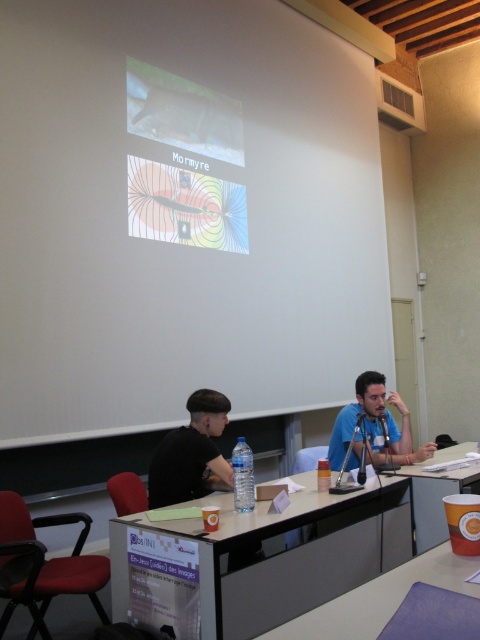
Is the position of black glossy table at center less distant than that of blue matte shirt at center?

Yes, it is in front of blue matte shirt at center.

You are a GUI agent. You are given a task and a screenshot of the screen. Output one action in this format:
    pyautogui.click(x=<x>, y=<y>)
    Task: Click on the black glossy table at center
    
    Given the screenshot: What is the action you would take?
    pyautogui.click(x=279, y=556)

Find the location of a particular element. This screenshot has height=640, width=480. black glossy table at center is located at coordinates (279, 556).

Is black matte shirt at lower left to the right of orange paper cup at lower right from the viewer's perspective?

Incorrect, black matte shirt at lower left is not on the right side of orange paper cup at lower right.

Measure the distance between black matte shirt at lower left and orange paper cup at lower right.

black matte shirt at lower left is 1.03 meters away from orange paper cup at lower right.

Who is more distant from viewer, [173,468] or [474,445]?

Point [474,445]

At what (x,y) coordinates should I click in order to perform the action: click on black matte shirt at lower left. Please return your answer as a coordinate pair (x, y). This screenshot has height=640, width=480. Looking at the image, I should click on (191, 452).

Does purple matte table at center have a larger size compared to orange paper cup at lower right?

Actually, purple matte table at center might be smaller than orange paper cup at lower right.

Is point (326, 608) closer to viewer compared to point (474, 474)?

Yes, it is in front of point (474, 474).

Where is `purple matte table at center`? purple matte table at center is located at coordinates (380, 598).